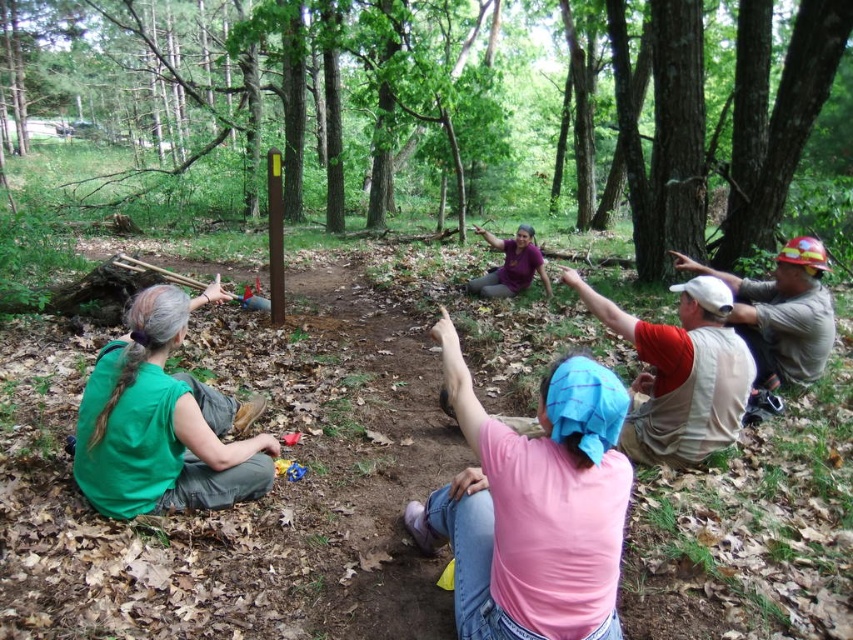
Who is positioned more to the right, brown wood post at upper center or gray fabric shirt at right?

From the viewer's perspective, gray fabric shirt at right appears more on the right side.

Does brown wood post at upper center appear under gray fabric shirt at right?

Actually, brown wood post at upper center is above gray fabric shirt at right.

Is point (646, 250) less distant than point (822, 332)?

No, (646, 250) is behind (822, 332).

Locate an element on the screen. brown wood post at upper center is located at coordinates (277, 104).

Between green fabric shirt at lower left and reddish-brown fabric shirt at center-right, which one has less height?

reddish-brown fabric shirt at center-right is shorter.

Between point (117, 353) and point (724, 388), which one is positioned behind?

Positioned behind is point (724, 388).

Where is `green fabric shirt at lower left`? green fabric shirt at lower left is located at coordinates (163, 420).

Is gray fabric shirt at right shorter than purple matte shirt at center?

Incorrect, gray fabric shirt at right's height does not fall short of purple matte shirt at center's.

Is gray fabric shirt at right wider than purple matte shirt at center?

In fact, gray fabric shirt at right might be narrower than purple matte shirt at center.

What are the coordinates of `gray fabric shirt at right` in the screenshot? It's located at (781, 314).

What are the coordinates of `gray fabric shirt at right` in the screenshot? It's located at (781, 314).